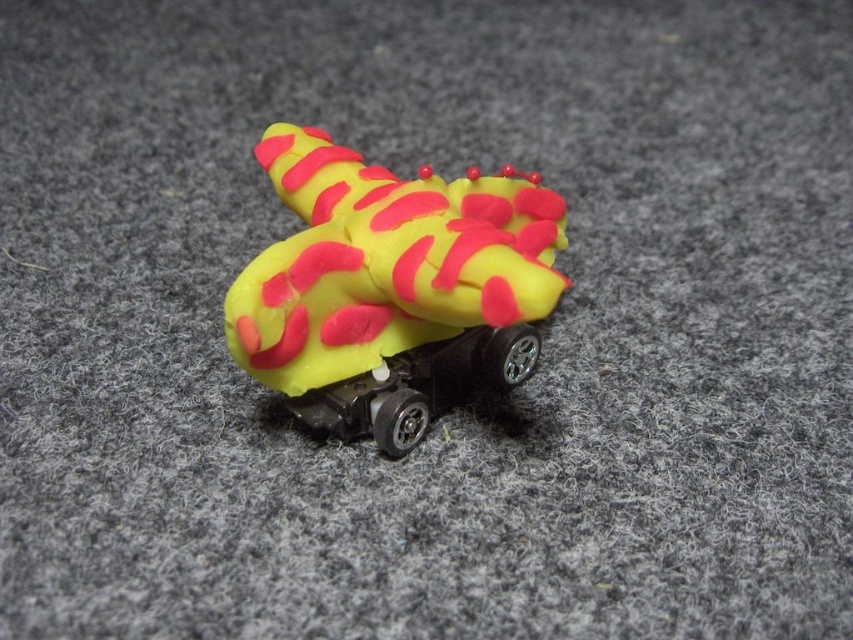
Question: Which of the following is the closest to the observer?

Choices:
 (A) (283, 353)
 (B) (389, 458)

Answer: (A)

Question: Can you confirm if yellow matte toy at center is positioned to the left of yellow matte toy car at center?

Choices:
 (A) no
 (B) yes

Answer: (B)

Question: Does yellow matte toy at center lie behind yellow matte toy car at center?

Choices:
 (A) no
 (B) yes

Answer: (A)

Question: Which of the following is the farthest from the observer?

Choices:
 (A) (242, 337)
 (B) (376, 438)

Answer: (B)

Question: Is yellow matte toy at center positioned at the back of yellow matte toy car at center?

Choices:
 (A) yes
 (B) no

Answer: (B)